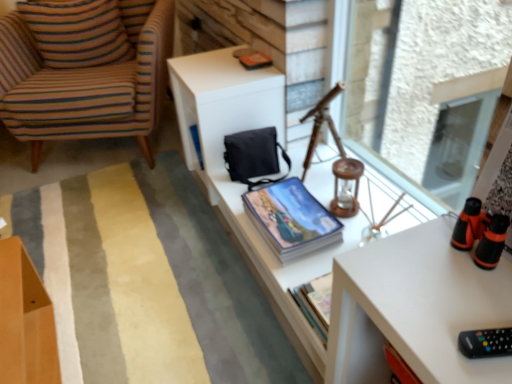
Question: Is matte blue magazine at upper center positioned in front of transparent glass window screen at upper right?

Choices:
 (A) no
 (B) yes

Answer: (A)

Question: Does matte blue magazine at upper center have a greater width compared to transparent glass window screen at upper right?

Choices:
 (A) yes
 (B) no

Answer: (B)

Question: Is matte blue magazine at upper center not inside transparent glass window screen at upper right?

Choices:
 (A) yes
 (B) no

Answer: (A)

Question: Is matte blue magazine at upper center surrounding transparent glass window screen at upper right?

Choices:
 (A) yes
 (B) no

Answer: (B)

Question: From a real-world perspective, is matte blue magazine at upper center physically below transparent glass window screen at upper right?

Choices:
 (A) yes
 (B) no

Answer: (B)

Question: From the image's perspective, relative to blue glossy book at center, is black plastic remote at lower right above or below?

Choices:
 (A) above
 (B) below

Answer: (B)

Question: From a real-world perspective, is black plastic remote at lower right above or below blue glossy book at center?

Choices:
 (A) below
 (B) above

Answer: (B)

Question: In terms of height, does black plastic remote at lower right look taller or shorter compared to blue glossy book at center?

Choices:
 (A) tall
 (B) short

Answer: (A)

Question: Considering the positions of black plastic remote at lower right and blue glossy book at center in the image, is black plastic remote at lower right bigger or smaller than blue glossy book at center?

Choices:
 (A) big
 (B) small

Answer: (A)

Question: Is white matte table at center in front of or behind striped fabric armchair at left in the image?

Choices:
 (A) front
 (B) behind

Answer: (A)

Question: Is white matte table at center wider or thinner than striped fabric armchair at left?

Choices:
 (A) wide
 (B) thin

Answer: (B)

Question: Is white matte table at center situated inside striped fabric armchair at left or outside?

Choices:
 (A) inside
 (B) outside

Answer: (B)

Question: Is point (230, 61) positioned closer to the camera than point (161, 48)?

Choices:
 (A) closer
 (B) farther

Answer: (A)

Question: From the image's perspective, is soft striped rug at center located above or below striped fabric pillow at left?

Choices:
 (A) above
 (B) below

Answer: (B)

Question: Considering their positions, is soft striped rug at center located in front of or behind striped fabric pillow at left?

Choices:
 (A) front
 (B) behind

Answer: (A)